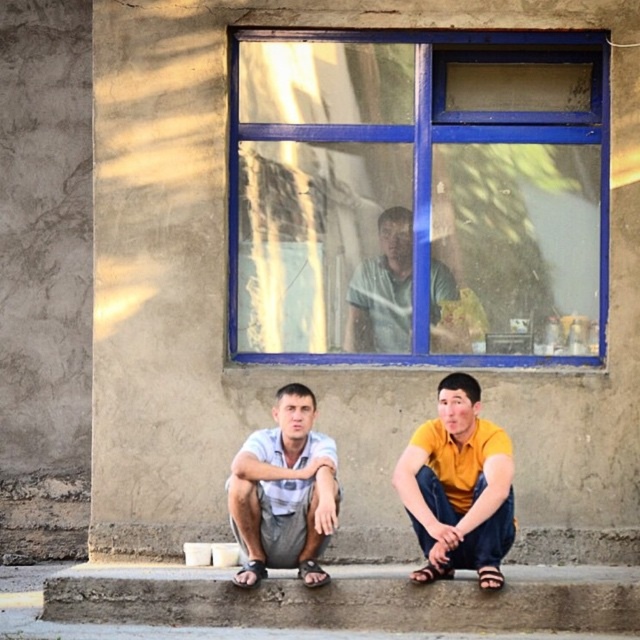
You are a photographer trying to capture a clear shot of the yellow matte shirt at lower right without the blue painted glass window at upper center obstructing the view. Is this possible given their positions?

The blue painted glass window at upper center is further to the viewer than the yellow matte shirt at lower right, so the window is closer to you. Therefore, it would obstruct the view of the yellow matte shirt at lower right, making it impossible to capture a clear shot without moving closer or adjusting your angle to avoid the window.

Based on the photo, you are standing at the point closest to the camera in the image. Which of the two points, point (300,109) or point (435,333), is farther away from you?

Point (300,109) is behind point (435,333), so if you are standing at the point closest to the camera, which is point (435,333), then point (300,109) is farther away from you.

You are a window installer assessing the space between the blue painted glass window at upper center and the yellow matte shirt at lower right. Can you determine if the window is wider than the shirt?

The blue painted glass window at upper center might be wider than yellow matte shirt at lower right according to the description, so it is possible that the window is wider than the shirt.